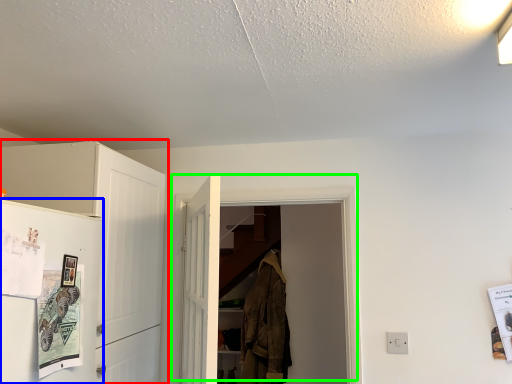
Question: Which object is positioned farthest from cabinetry (highlighted by a red box)? Select from fridge (highlighted by a blue box) and door (highlighted by a green box).

Choices:
 (A) fridge
 (B) door

Answer: (B)